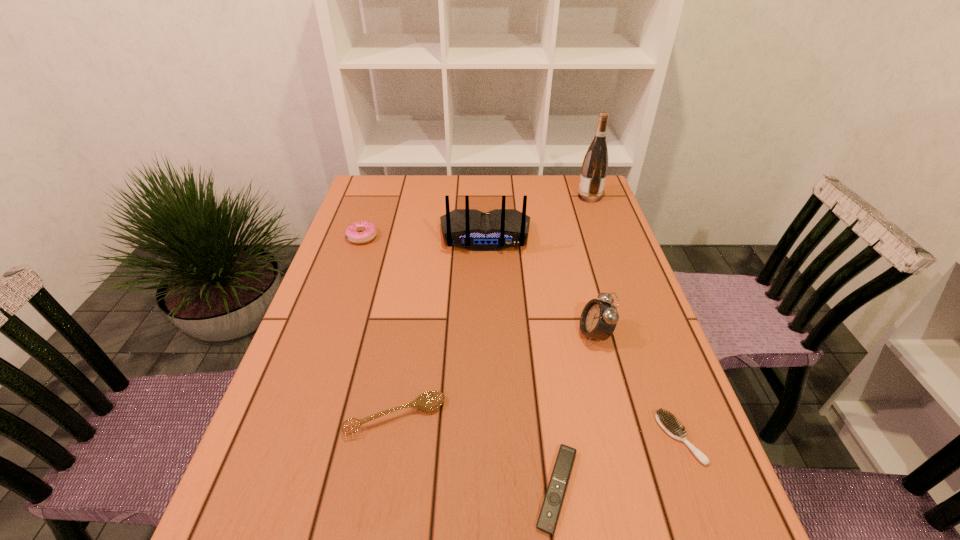
Identify the location of vacant position located on the left of the shortest object. The width and height of the screenshot is (960, 540). (418, 489).

Where is `object that is at the far edge`? The width and height of the screenshot is (960, 540). object that is at the far edge is located at coordinates (595, 164).

Locate an element on the screen. Image resolution: width=960 pixels, height=540 pixels. doughnut that is at the left edge is located at coordinates (361, 232).

This screenshot has height=540, width=960. Find the location of `ladle present at the left edge`. ladle present at the left edge is located at coordinates (428, 401).

I want to click on wine bottle located at the right edge, so coord(595,164).

The height and width of the screenshot is (540, 960). What are the coordinates of `alarm clock situated at the right edge` in the screenshot? It's located at (598, 320).

Where is `scrubbing brush positioned at the right edge`? The height and width of the screenshot is (540, 960). scrubbing brush positioned at the right edge is located at coordinates (667, 422).

Where is `object positioned at the far right corner`? The width and height of the screenshot is (960, 540). object positioned at the far right corner is located at coordinates (595, 164).

You are a GUI agent. You are given a task and a screenshot of the screen. Output one action in this format:
    pyautogui.click(x=<x>, y=<y>)
    Task: Click on the vacant space at the far edge of the desktop
    Image resolution: width=960 pixels, height=540 pixels.
    Given the screenshot: What is the action you would take?
    pyautogui.click(x=439, y=208)

Identify the location of vacant space at the left edge of the desktop. (356, 348).